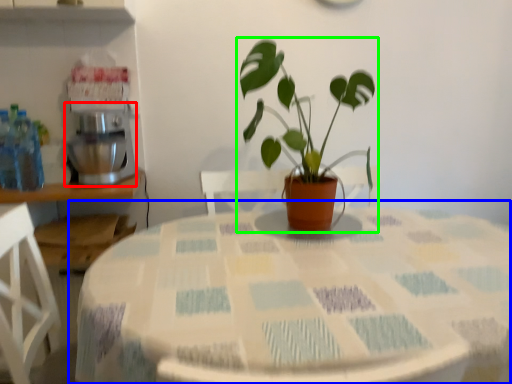
Question: Based on their relative distances, which object is farther from mixer (highlighted by a red box)? Choose from table (highlighted by a blue box) and houseplant (highlighted by a green box).

Choices:
 (A) table
 (B) houseplant

Answer: (A)